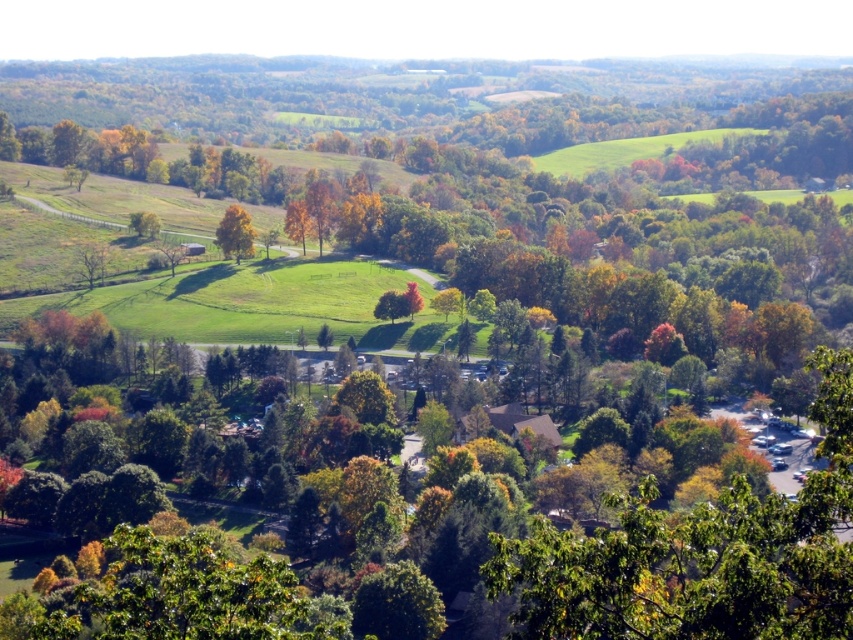
Question: In this image, where is yellow-green leafy tree at center-left located relative to orange matte tree at center?

Choices:
 (A) right
 (B) left

Answer: (B)

Question: Which of the following is the farthest from the observer?

Choices:
 (A) orange matte tree at center
 (B) yellow-green leafy tree at center-left
 (C) green matte tree at center

Answer: (A)

Question: Among these points, which one is nearest to the camera?

Choices:
 (A) (397, 294)
 (B) (296, 221)

Answer: (A)

Question: Does orange matte tree at center lie in front of green matte tree at center?

Choices:
 (A) no
 (B) yes

Answer: (A)

Question: Can you confirm if yellow-green leafy tree at center-left is positioned below green matte tree at center?

Choices:
 (A) no
 (B) yes

Answer: (A)

Question: Among these objects, which one is nearest to the camera?

Choices:
 (A) yellow-green leafy tree at center-left
 (B) green matte tree at center
 (C) orange matte tree at center

Answer: (B)